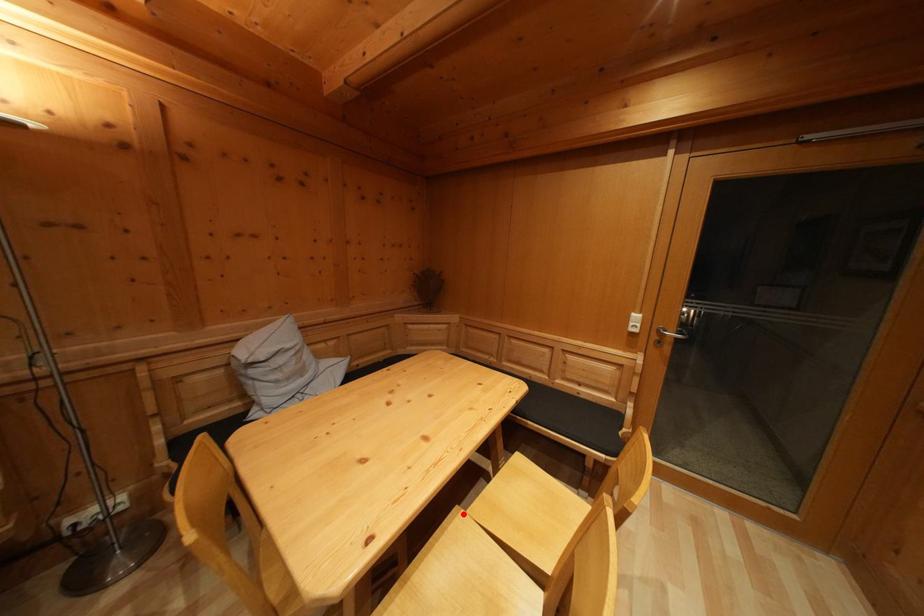
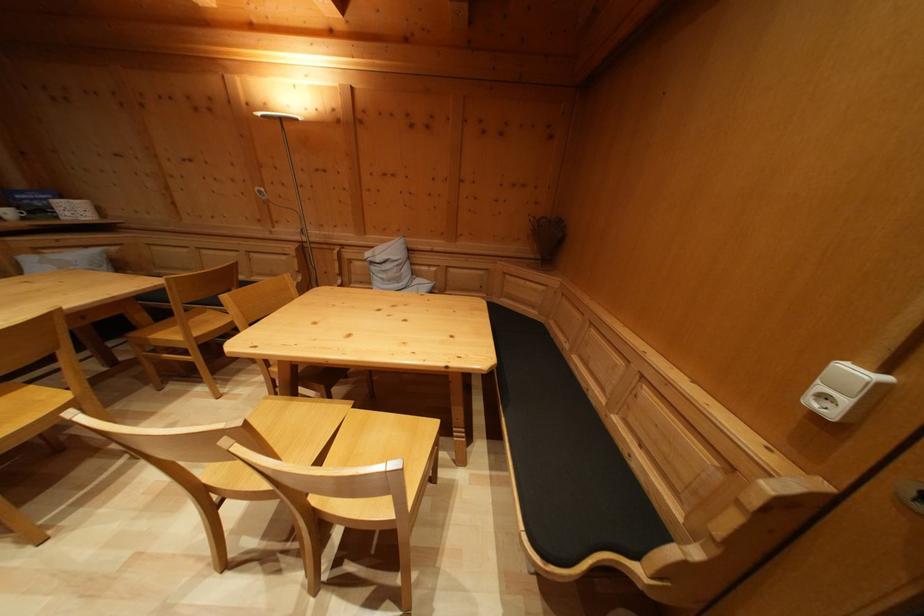
Find the pixel in the second image that matches the highlighted location in the first image.

(359, 408)